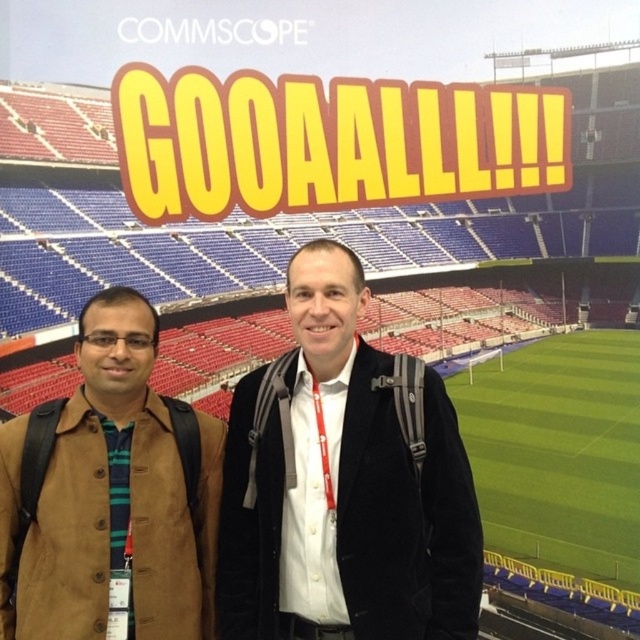
Can you confirm if black velvet jacket at center is taller than brown suede jacket at left?

Correct, black velvet jacket at center is much taller as brown suede jacket at left.

The height and width of the screenshot is (640, 640). What do you see at coordinates (344, 483) in the screenshot?
I see `black velvet jacket at center` at bounding box center [344, 483].

Which is in front, point (241, 509) or point (81, 598)?

Point (81, 598) is in front.

Locate an element on the screen. black velvet jacket at center is located at coordinates (344, 483).